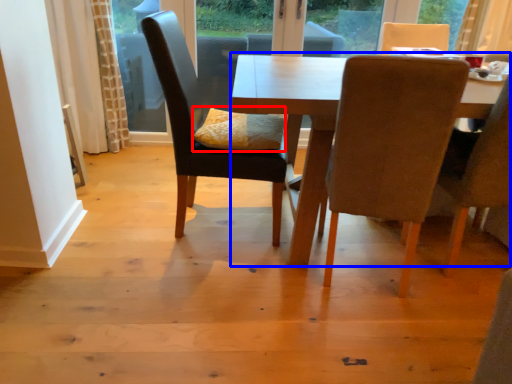
Question: Which of the following is the closest to the observer, pillow (highlighted by a red box) or kitchen & dining room table (highlighted by a blue box)?

Choices:
 (A) pillow
 (B) kitchen & dining room table

Answer: (B)